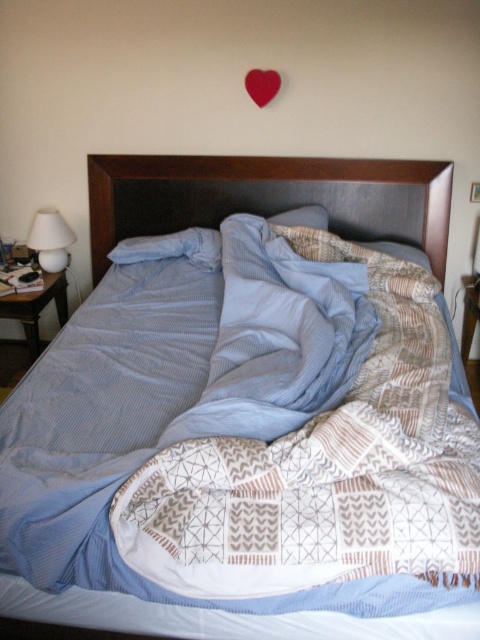
You are standing at the origin of the coordinate system in the bedroom. There are two points marked in the scene, point (145, 227) and point (272, 88). Which point is closer to you?

Point (272, 88) is closer to you because it is in front of point (145, 227).

You are standing at the foot of the bed and want to place a new decorative item on the surface that is higher between the dark brown fabric headboard at center and the white glossy lamp at left. Which surface should you choose?

The dark brown fabric headboard at center is above the white glossy lamp at left, so you should place the decorative item on the dark brown fabric headboard at center since it is higher.

You are standing at the foot of the bed and want to reach both the dark brown fabric headboard at center and the white glossy lamp at left. Which object is closer to your current position?

The white glossy lamp at left is closer to your current position because it is to the left of the dark brown fabric headboard at center, and you are at the foot of the bed facing the headboard. Since the headboard is at the center of the bed, the lamp is positioned to the left side of the bed, making it closer when approaching from the foot.